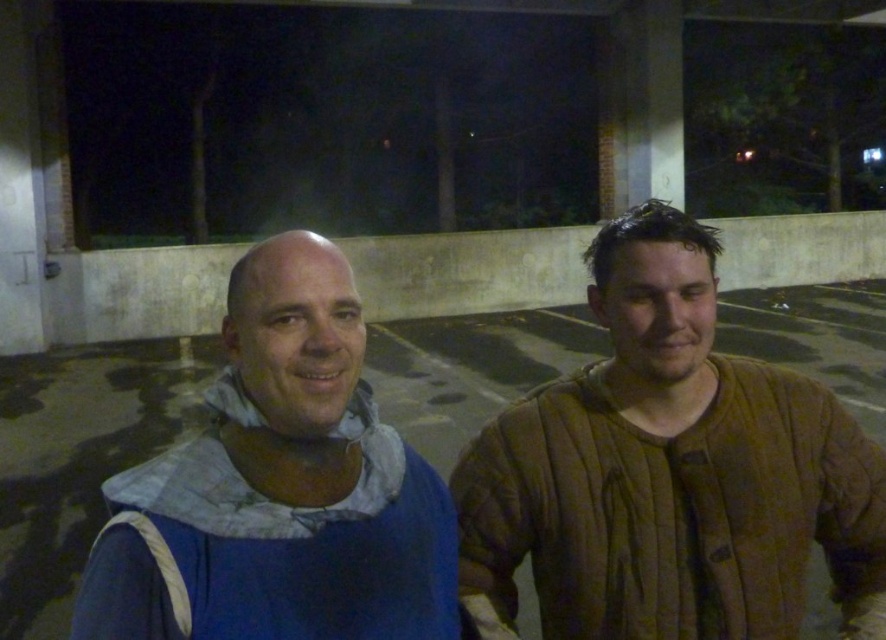
You are a fashion designer observing two people in a parking lot. You need to determine which garment has a greater width for a client who prefers wider clothing. Which garment between the brown quilted jacket at right and the blue fabric at left is wider?

The brown quilted jacket at right has a greater width than the blue fabric at left, so it is the wider garment.

You are standing in a dimly lit parking lot and see the brown quilted jacket at right. You want to hand a small item to the person wearing it without approaching closer than 3 feet. Can you reach them from your current position?

The brown quilted jacket at right is 3.70 feet away from the viewer. Since you need to stay at least 3 feet away, you are already within the required distance. However, since the jacket is 3.70 feet away, you can extend your arm to hand the item without moving closer than 3 feet.

You are standing in a parking lot at night. There is a point marked at coordinates (650, 388). If you want to place a 1.5 meter long pole from your current position to that point, will it reach?

The point at (650, 388) is 1.25 meters away from the viewer. Since the pole is 1.5 meters long, it will extend beyond the point, reaching it and extending an additional 0.25 meters beyond.